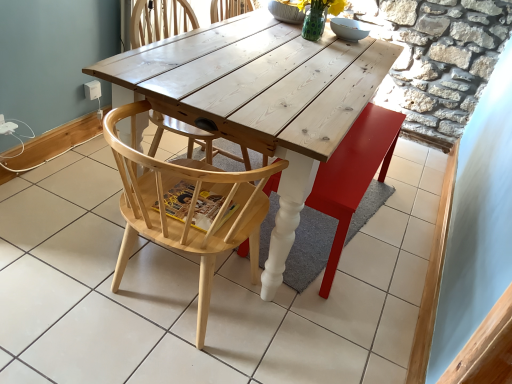
The width and height of the screenshot is (512, 384). In order to click on white wood table at center in this screenshot , I will do `click(196, 290)`.

Find the location of a particular element. natural wood chair at center, which is the second chair in front-to-back order is located at coordinates (159, 20).

How many degrees apart are the facing directions of white wood table at center and natural wood chair at center, the first chair when ordered from back to front?

The facing directions of white wood table at center and natural wood chair at center, the first chair when ordered from back to front, are 0.209 degrees apart.

Which is behind, white wood table at center or natural wood chair at center, which is the second chair in front-to-back order?

natural wood chair at center, which is the second chair in front-to-back order.

Can you confirm if white wood table at center is wider than natural wood chair at center, which is the second chair in front-to-back order?

Correct, the width of white wood table at center exceeds that of natural wood chair at center, which is the second chair in front-to-back order.

Are natural wood chair at center, the first chair when ordered from back to front, and wooden swivel chair at center far apart?

No, there isn't a large distance between natural wood chair at center, the first chair when ordered from back to front, and wooden swivel chair at center.

From the image's perspective, which one is positioned lower, natural wood chair at center, the first chair when ordered from back to front, or wooden swivel chair at center?

wooden swivel chair at center, from the image's perspective.

In the scene shown: Considering the sizes of objects natural wood chair at center, which is the second chair in front-to-back order, and wooden swivel chair at center in the image provided, who is thinner, natural wood chair at center, which is the second chair in front-to-back order, or wooden swivel chair at center?

wooden swivel chair at center is thinner.

Is natural wood chair at center, the first chair when ordered from back to front, positioned in front of wooden swivel chair at center?

Yes, it is.

Is wooden swivel chair at center next to white wood table at center and touching it?

No, wooden swivel chair at center is not with white wood table at center.

From a real-world perspective, is wooden swivel chair at center on top of white wood table at center?

Indeed, from a real-world perspective, wooden swivel chair at center stands above white wood table at center.

Considering the relative sizes of wooden swivel chair at center and white wood table at center in the image provided, is wooden swivel chair at center taller than white wood table at center?

Indeed, wooden swivel chair at center has a greater height compared to white wood table at center.

Which object is thinner, wooden swivel chair at center or white wood table at center?

wooden swivel chair at center.

Does natural wood chair at center, the first chair when ordered from back to front, have a lesser width compared to white wood table at center?

Yes, natural wood chair at center, the first chair when ordered from back to front, is thinner than white wood table at center.

Consider the image. Is white wood table at center at the back of natural wood chair at center, which is the second chair in front-to-back order?

No, natural wood chair at center, which is the second chair in front-to-back order, is not facing away from white wood table at center.

Is natural wood chair at center, which is the second chair in front-to-back order, next to white wood table at center?

natural wood chair at center, which is the second chair in front-to-back order, is not next to white wood table at center, and they're not touching.

From the image's perspective, relative to natural wood chair at center, the 1th chair viewed from the front, is wooden swivel chair at center above or below?

Clearly, from the image's perspective, wooden swivel chair at center is above natural wood chair at center, the 1th chair viewed from the front.

From the picture: Could you tell me if wooden swivel chair at center is turned towards natural wood chair at center, the 1th chair viewed from the front?

No, wooden swivel chair at center is not facing towards natural wood chair at center, the 1th chair viewed from the front.

Is wooden swivel chair at center not near natural wood chair at center, which is counted as the 2th chair, starting from the back?

No.

Does white wood table at center turn towards wooden swivel chair at center?

No, white wood table at center is not oriented towards wooden swivel chair at center.

Can you confirm if white wood table at center is positioned to the right of wooden swivel chair at center?

No, white wood table at center is not to the right of wooden swivel chair at center.

Is white wood table at center in contact with wooden swivel chair at center?

No.

From a real-world perspective, which object rests below the other?

In real-world perspective, white wood table at center is lower.

Considering the positions of objects natural wood chair at center, which is counted as the 2th chair, starting from the back, and white wood table at center in the image provided, who is in front, natural wood chair at center, which is counted as the 2th chair, starting from the back, or white wood table at center?

Positioned in front is natural wood chair at center, which is counted as the 2th chair, starting from the back.

Is natural wood chair at center, the 1th chair viewed from the front, positioned beyond the bounds of white wood table at center?

natural wood chair at center, the 1th chair viewed from the front, lies outside white wood table at center's area.

Which chair is the 1st one when counting from the left side of the white wood table at center? Please provide its 2D coordinates.

[(186, 207)]

Which is behind, point (138, 186) or point (170, 277)?

The point (170, 277) is more distant.

Identify the location of the 2nd chair positioned above the white wood table at center (from a real-world perspective). (159, 20).

Find the location of a particular element. This screenshot has height=384, width=512. the 1st chair in front of the wooden swivel chair at center is located at coordinates (159, 20).

Considering their positions, is white wood table at center positioned closer to natural wood chair at center, the 1th chair viewed from the front, than wooden swivel chair at center?

wooden swivel chair at center lies closer to natural wood chair at center, the 1th chair viewed from the front, than the other object.

Based on their spatial positions, is wooden swivel chair at center or white wood table at center further from natural wood chair at center, which is the second chair in front-to-back order?

white wood table at center is further to natural wood chair at center, which is the second chair in front-to-back order.

When comparing their distances from wooden swivel chair at center, does white wood table at center or natural wood chair at center, the first chair when ordered from back to front, seem further?

Among the two, natural wood chair at center, the first chair when ordered from back to front, is located further to wooden swivel chair at center.

From the picture: Which object lies nearer to the anchor point natural wood chair at center, the first chair when ordered from back to front, white wood table at center or natural wood chair at center, the 1th chair viewed from the front?

natural wood chair at center, the 1th chair viewed from the front.

Considering their positions, is natural wood chair at center, the first chair when ordered from back to front, positioned further to natural wood chair at center, the 1th chair viewed from the front, than wooden swivel chair at center?

Based on the image, natural wood chair at center, the first chair when ordered from back to front, appears to be further to natural wood chair at center, the 1th chair viewed from the front.

Estimate the real-world distances between objects in this image. Which object is closer to natural wood chair at center, the 1th chair viewed from the front, white wood table at center or natural wood chair at center, which is the second chair in front-to-back order?

The object closer to natural wood chair at center, the 1th chair viewed from the front, is white wood table at center.

When comparing their distances from natural wood chair at center, the first chair when ordered from back to front, does natural wood chair at center, the 1th chair viewed from the front, or white wood table at center seem closer?

The object closer to natural wood chair at center, the first chair when ordered from back to front, is natural wood chair at center, the 1th chair viewed from the front.

Considering their positions, is natural wood chair at center, which is the second chair in front-to-back order, positioned closer to wooden swivel chair at center than white wood table at center?

white wood table at center is closer to wooden swivel chair at center.

Locate an element on the screen. This screenshot has width=512, height=384. tile between natural wood chair at center, which is counted as the 2th chair, starting from the back, and wooden swivel chair at center in the front-back direction is located at coordinates (196, 290).

Identify the location of tile between natural wood chair at center, the 1th chair viewed from the front, and natural wood chair at center, which is the second chair in front-to-back order, in the front-back direction. (196, 290).

In order to click on chair between natural wood chair at center, which is the second chair in front-to-back order, and wooden swivel chair at center from left to right in this screenshot , I will do `click(186, 207)`.

Image resolution: width=512 pixels, height=384 pixels. I want to click on tile situated between natural wood chair at center, the first chair when ordered from back to front, and wooden swivel chair at center from left to right, so click(x=196, y=290).